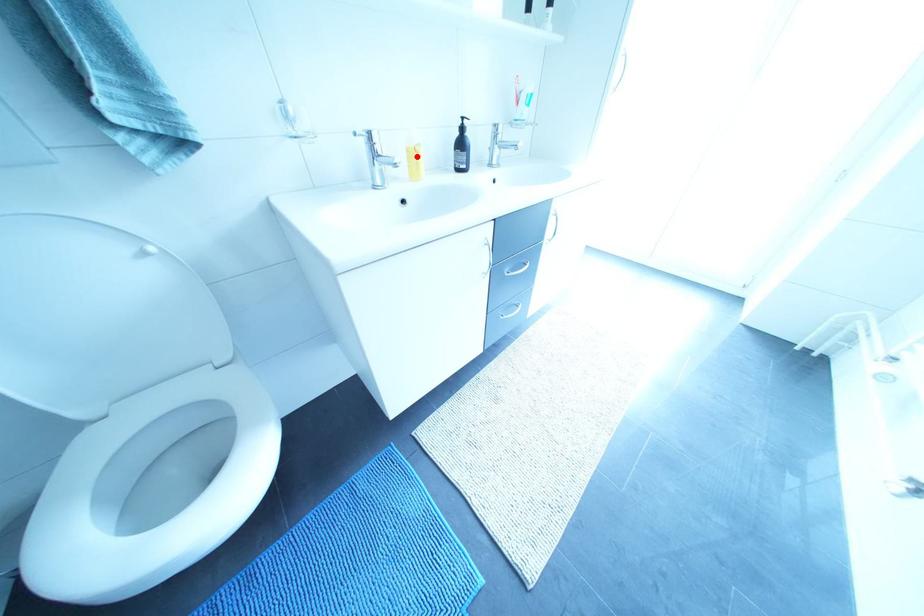
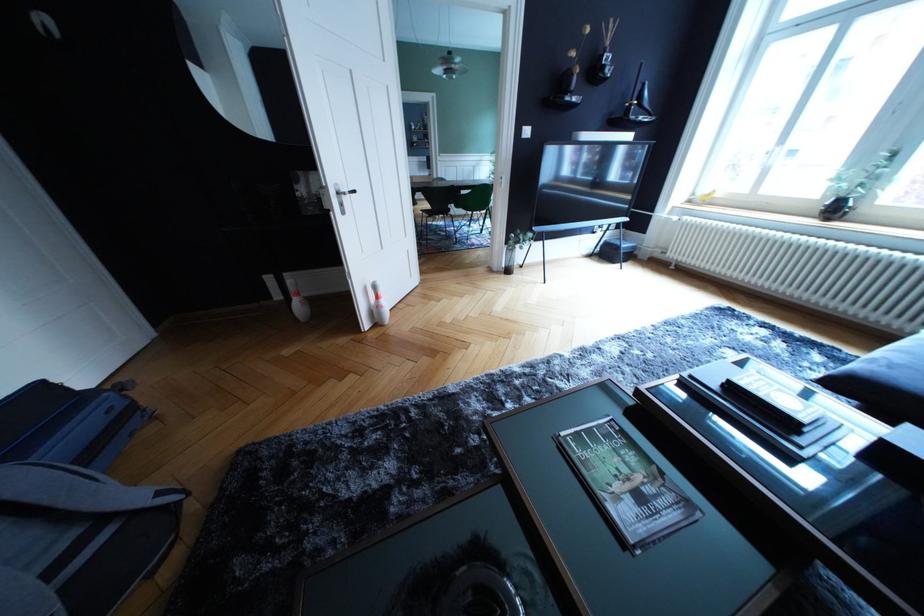
Question: I am providing you with two images of the same scene from different viewpoints. A red point is marked on the first image. Is the red point's position out of view in image 2?

Choices:
 (A) Yes
 (B) No

Answer: (A)